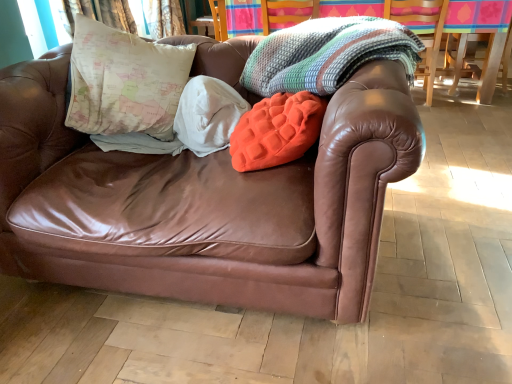
Question: Is knitted multicolor blanket at upper center, marked as the 2th blanket in a left-to-right arrangement, turned away from brown leather couch at center?

Choices:
 (A) yes
 (B) no

Answer: (A)

Question: From a real-world perspective, does knitted multicolor blanket at upper center, marked as the 2th blanket in a left-to-right arrangement, sit lower than brown leather couch at center?

Choices:
 (A) no
 (B) yes

Answer: (A)

Question: Does knitted multicolor blanket at upper center, marked as the 2th blanket in a left-to-right arrangement, have a greater width compared to brown leather couch at center?

Choices:
 (A) no
 (B) yes

Answer: (A)

Question: From the image's perspective, is knitted multicolor blanket at upper center, marked as the 2th blanket in a left-to-right arrangement, on top of brown leather couch at center?

Choices:
 (A) yes
 (B) no

Answer: (A)

Question: Considering the relative positions of wooden swivel chair at upper right and white soft blanket at center, the 2th blanket viewed from the right, in the image provided, is wooden swivel chair at upper right to the left or to the right of white soft blanket at center, the 2th blanket viewed from the right,?

Choices:
 (A) left
 (B) right

Answer: (B)

Question: Is wooden swivel chair at upper right taller or shorter than white soft blanket at center, the 2th blanket viewed from the right?

Choices:
 (A) tall
 (B) short

Answer: (A)

Question: Which is correct: wooden swivel chair at upper right is inside white soft blanket at center, marked as the first blanket in a left-to-right arrangement, or outside of it?

Choices:
 (A) outside
 (B) inside

Answer: (A)

Question: From a real-world perspective, is wooden swivel chair at upper right physically located above or below white soft blanket at center, marked as the first blanket in a left-to-right arrangement?

Choices:
 (A) above
 (B) below

Answer: (B)

Question: Looking at their shapes, would you say white soft blanket at center, the 2th blanket viewed from the right, is wider or thinner than knitted multicolored blanket at upper center?

Choices:
 (A) wide
 (B) thin

Answer: (B)

Question: Is white soft blanket at center, marked as the first blanket in a left-to-right arrangement, situated inside knitted multicolored blanket at upper center or outside?

Choices:
 (A) outside
 (B) inside

Answer: (A)

Question: Considering the positions of white soft blanket at center, the 2th blanket viewed from the right, and knitted multicolored blanket at upper center in the image, is white soft blanket at center, the 2th blanket viewed from the right, taller or shorter than knitted multicolored blanket at upper center?

Choices:
 (A) short
 (B) tall

Answer: (A)

Question: Is white soft blanket at center, the 2th blanket viewed from the right, bigger or smaller than knitted multicolored blanket at upper center?

Choices:
 (A) small
 (B) big

Answer: (A)

Question: Looking at their shapes, would you say brown leather couch at center is wider or thinner than knitted multicolored blanket at upper center?

Choices:
 (A) wide
 (B) thin

Answer: (A)

Question: From the image's perspective, is brown leather couch at center above or below knitted multicolored blanket at upper center?

Choices:
 (A) above
 (B) below

Answer: (B)